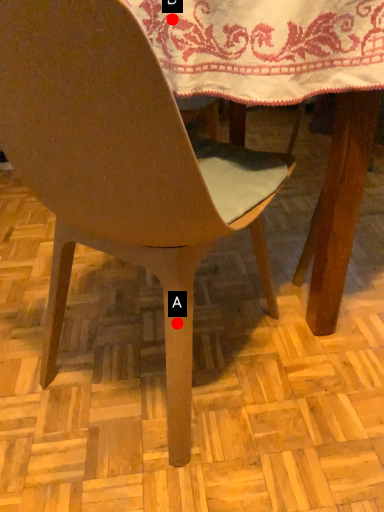
Question: Two points are circled on the image, labeled by A and B beside each circle. Which point appears farthest from the camera in this image?

Choices:
 (A) A is further
 (B) B is further

Answer: (A)